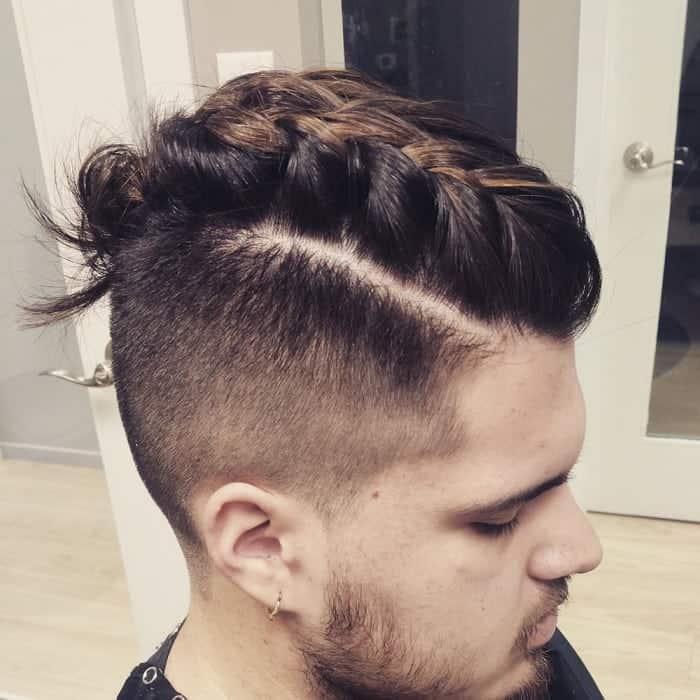
Find the location of a particular element. The width and height of the screenshot is (700, 700). doorknob is located at coordinates (74, 377), (633, 154).